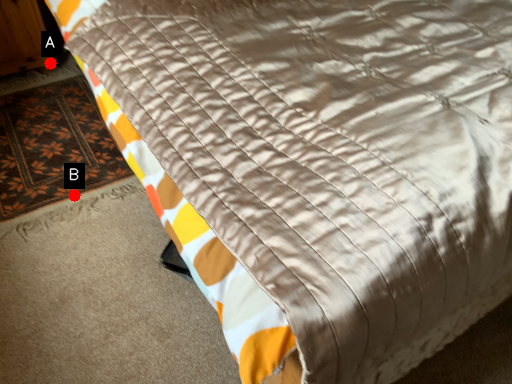
Question: Two points are circled on the image, labeled by A and B beside each circle. Which point is further to the camera?

Choices:
 (A) A is further
 (B) B is further

Answer: (A)